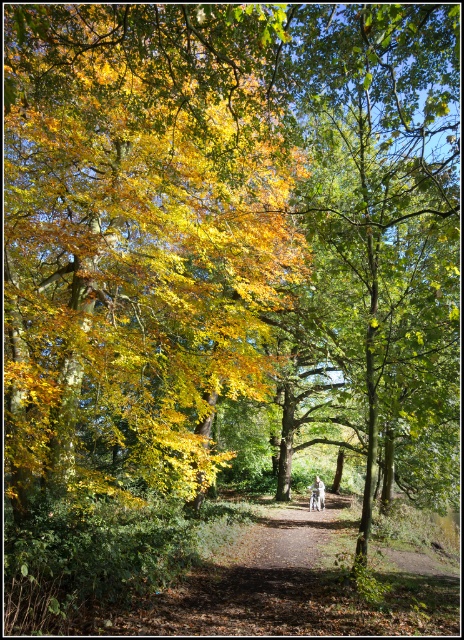
Question: Is golden yellow leaves at center below white cotton shirt at center?

Choices:
 (A) no
 (B) yes

Answer: (A)

Question: Does golden yellow leaves at center appear on the left side of white cotton shirt at center?

Choices:
 (A) no
 (B) yes

Answer: (B)

Question: Is golden yellow leaves at center positioned before white cotton shirt at center?

Choices:
 (A) no
 (B) yes

Answer: (B)

Question: Among these objects, which one is nearest to the camera?

Choices:
 (A) golden yellow leaves at center
 (B) white cotton shirt at center

Answer: (A)